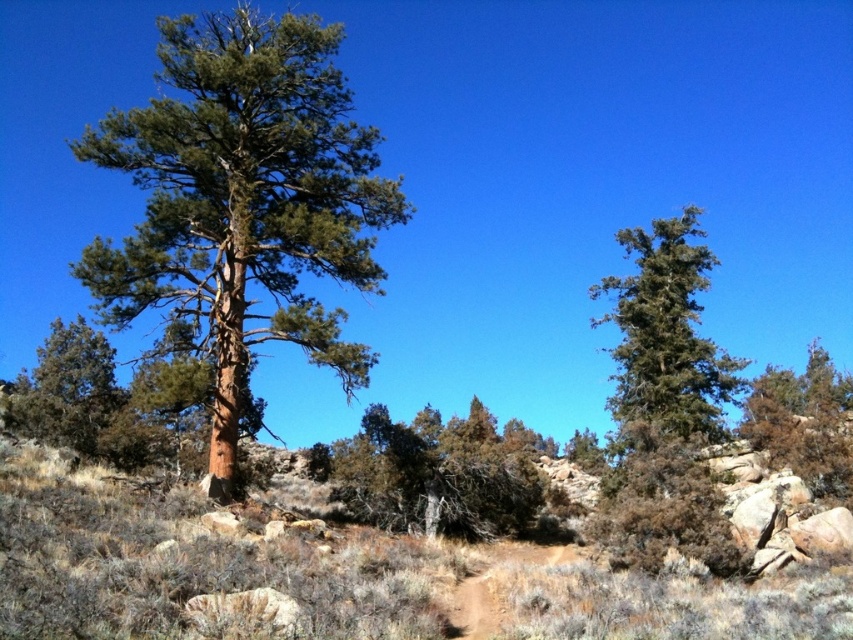
Question: Does brown/dry shrub at center come behind green needle-like tree at left?

Choices:
 (A) no
 (B) yes

Answer: (A)

Question: Does green matte tree at upper right appear over brown dirt track at center?

Choices:
 (A) no
 (B) yes

Answer: (B)

Question: Which point is closer to the camera?

Choices:
 (A) green rough bark tree at left
 (B) green matte tree at upper right
 (C) brown/dry shrub at center
 (D) green rough bark tree at right

Answer: (A)

Question: Which point appears farthest from the camera in this image?

Choices:
 (A) (680, 276)
 (B) (59, 353)
 (C) (567, 556)
 (D) (424, 506)

Answer: (A)

Question: Which point is farther from the camera taking this photo?

Choices:
 (A) click(x=642, y=259)
 (B) click(x=161, y=424)
 (C) click(x=195, y=320)
 (D) click(x=450, y=614)

Answer: (A)

Question: Can you confirm if green needle-like tree at left is positioned to the right of green rough bark tree at right?

Choices:
 (A) no
 (B) yes

Answer: (A)